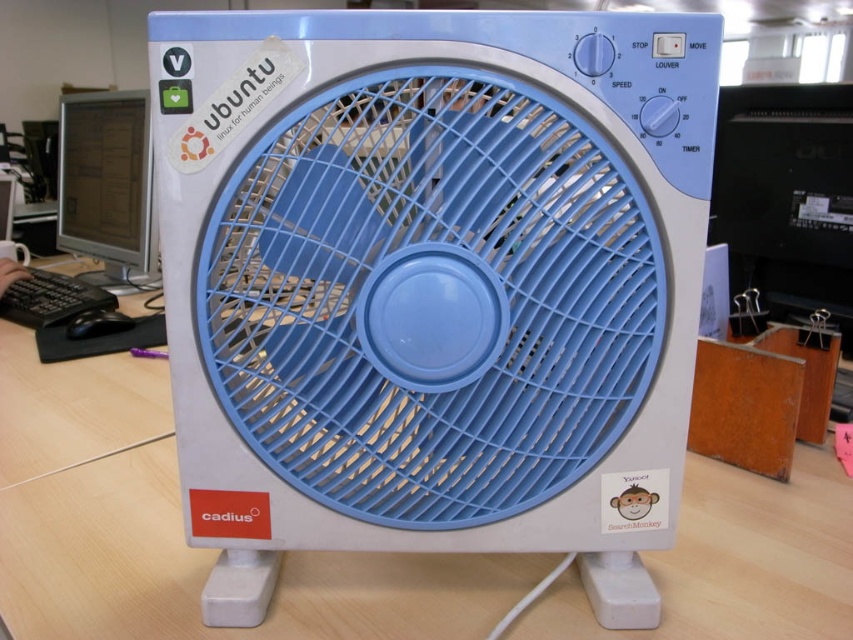
Describe the element at coordinates (180, 529) in the screenshot. I see `white plastic computer desk at center` at that location.

Does white plastic computer desk at center appear under matte black monitor at left?

Yes, white plastic computer desk at center is below matte black monitor at left.

Where is `white plastic computer desk at center`? Image resolution: width=853 pixels, height=640 pixels. white plastic computer desk at center is located at coordinates (180, 529).

Is blue plastic fan at center smaller than white plastic computer desk at center?

Correct, blue plastic fan at center occupies less space than white plastic computer desk at center.

Consider the image. Which of these two, blue plastic fan at center or white plastic computer desk at center, stands shorter?

white plastic computer desk at center is shorter.

Does point (668, 138) lie behind point (115, 618)?

No, (668, 138) is in front of (115, 618).

This screenshot has height=640, width=853. What are the coordinates of `blue plastic fan at center` in the screenshot? It's located at (432, 284).

Who is more distant from viewer, (194, 246) or (82, 202)?

Point (82, 202)

Between blue plastic fan at center and matte black monitor at left, which one appears on the right side from the viewer's perspective?

Positioned to the right is blue plastic fan at center.

Between point (328, 520) and point (74, 173), which one is positioned behind?

Positioned behind is point (74, 173).

Where is `blue plastic fan at center`? blue plastic fan at center is located at coordinates (432, 284).